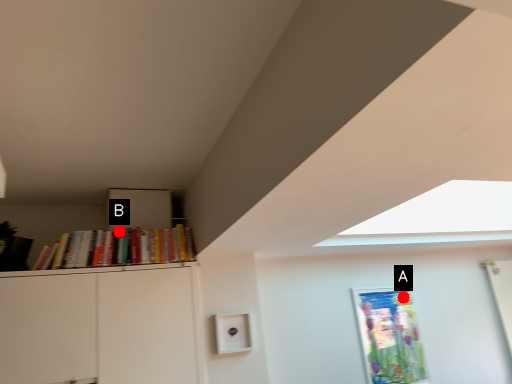
Question: Two points are circled on the image, labeled by A and B beside each circle. Which point is farther from the camera taking this photo?

Choices:
 (A) A is further
 (B) B is further

Answer: (A)